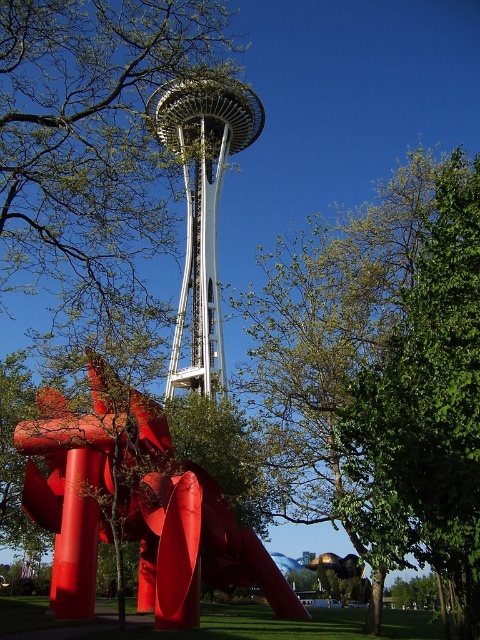
Consider the image. You are standing at the base of the Space Needle and notice a point marked at coordinates (384, 376). What object is located at that point?

The point at coordinates (384, 376) marks a green leafy tree at center.

You are standing in the park and see the green leafy tree at center and the glossy red sculpture at lower left. Which object is higher up in the image?

The green leafy tree at center is located above the glossy red sculpture at lower left, so it is higher up in the image.